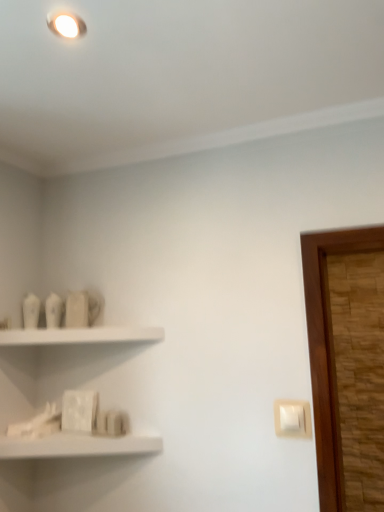
Question: In terms of width, does white matte shelf at lower left, which is the 2th shelf from top to bottom, look wider or thinner when compared to white matte shelf at upper left, the 1th shelf in the top-to-bottom sequence?

Choices:
 (A) thin
 (B) wide

Answer: (B)

Question: From a real-world perspective, is white matte shelf at lower left, which is the 2th shelf from top to bottom, physically located above or below white matte shelf at upper left, the 1th shelf in the top-to-bottom sequence?

Choices:
 (A) below
 (B) above

Answer: (A)

Question: Which object is positioned farthest from the white matte shelf at upper left, the 1th shelf in the top-to-bottom sequence?

Choices:
 (A) white matte shelf at lower left, which is the 2th shelf from top to bottom
 (B) white plastic light switch at lower right

Answer: (B)

Question: Which object is positioned farthest from the white matte shelf at upper left, placed as the second shelf when sorted from bottom to top?

Choices:
 (A) white plastic light switch at lower right
 (B) white matte shelf at lower left, which is the 2th shelf from top to bottom

Answer: (A)